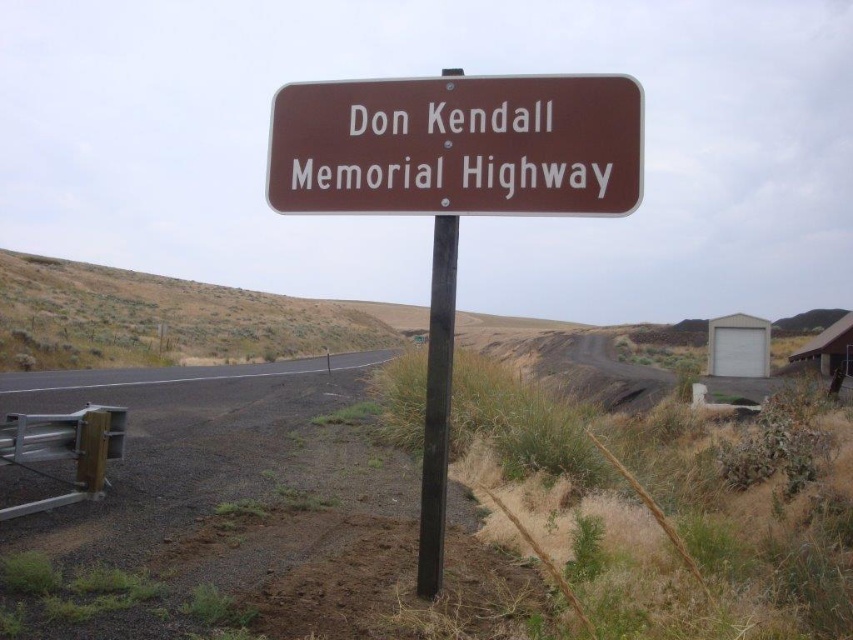
Does brown metallic sign at center appear on the right side of black metal pole at center?

Correct, you'll find brown metallic sign at center to the right of black metal pole at center.

Between brown metallic sign at center and black metal pole at center, which one has less height?

Standing shorter between the two is brown metallic sign at center.

You are a GUI agent. You are given a task and a screenshot of the screen. Output one action in this format:
    pyautogui.click(x=<x>, y=<y>)
    Task: Click on the brown metallic sign at center
    Image resolution: width=853 pixels, height=640 pixels.
    Given the screenshot: What is the action you would take?
    pyautogui.click(x=457, y=145)